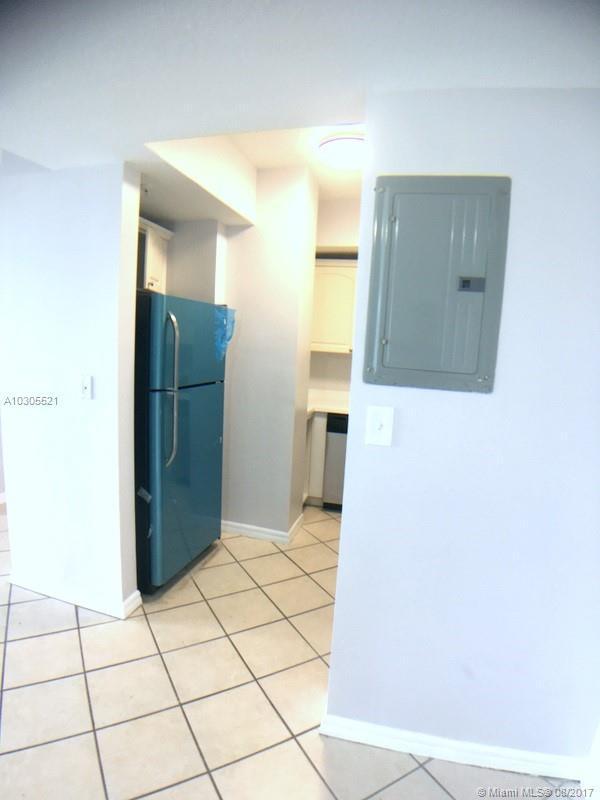
Image resolution: width=600 pixels, height=800 pixels. I want to click on dishwasher, so click(333, 446).